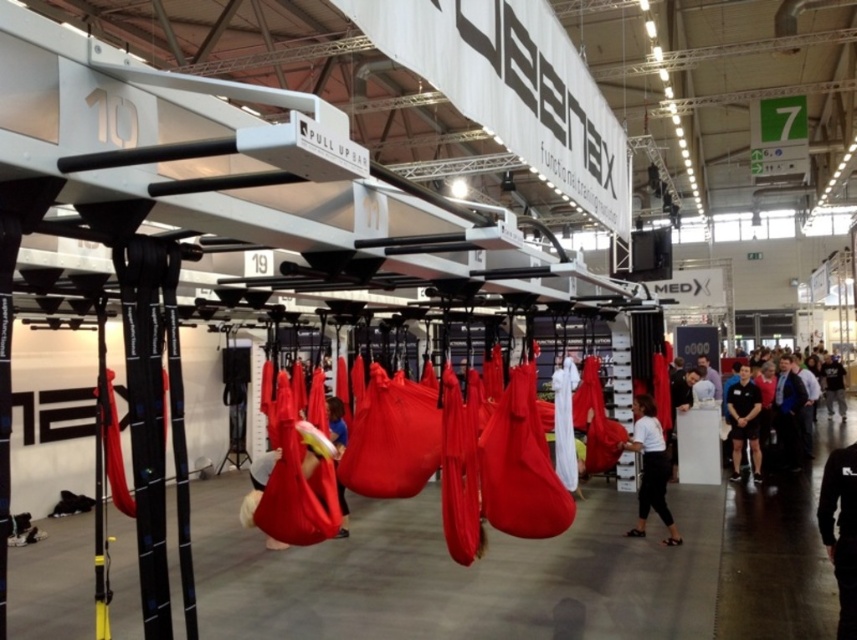
Who is taller, white matte shirt at center or blue fabric at center?

Standing taller between the two is white matte shirt at center.

Can you confirm if white matte shirt at center is shorter than blue fabric at center?

In fact, white matte shirt at center may be taller than blue fabric at center.

Is point (643, 531) closer to camera compared to point (345, 532)?

Yes, point (643, 531) is closer to viewer.

The height and width of the screenshot is (640, 857). In order to click on white matte shirt at center in this screenshot , I will do pos(650,468).

Is point (853, 577) behind point (679, 544)?

That is False.

Is black fabric pants at lower right bigger than white matte shirt at center?

No.

This screenshot has height=640, width=857. I want to click on black fabric pants at lower right, so click(x=840, y=531).

Describe the element at coordinates (840, 531) in the screenshot. I see `black fabric pants at lower right` at that location.

Where is `black fabric pants at lower right`? black fabric pants at lower right is located at coordinates (840, 531).

The height and width of the screenshot is (640, 857). I want to click on black fabric pants at lower right, so click(840, 531).